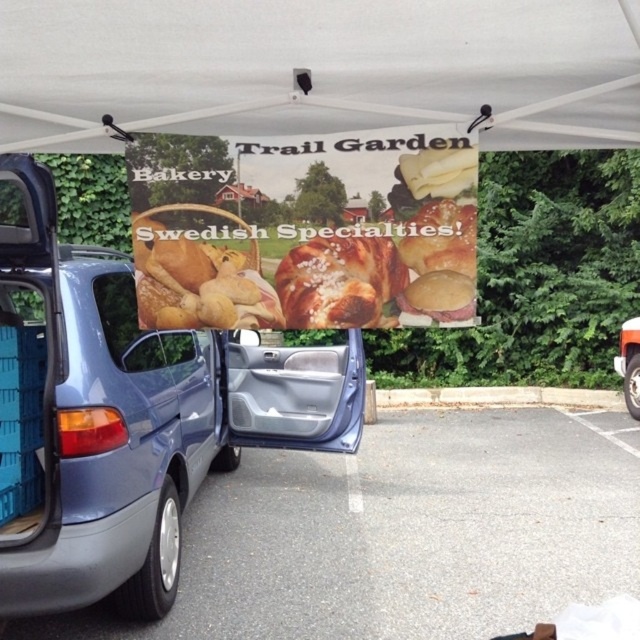
Question: Does gray asphalt parking lot at lower left come behind breadcrustyatcenter?

Choices:
 (A) yes
 (B) no

Answer: (A)

Question: Which of the following is the farthest from the observer?

Choices:
 (A) golden crusty bread at center
 (B) brown matte bun at center
 (C) breadcrustyatcenter

Answer: (B)

Question: Is breadcrustyatcenter wider than golden brown bread at center?

Choices:
 (A) no
 (B) yes

Answer: (B)

Question: Which of the following is the closest to the observer?

Choices:
 (A) yellow cheese at upper center
 (B) golden brown bread at center
 (C) brown matte bun at center
 (D) gray asphalt parking lot at lower left

Answer: (B)

Question: Considering the real-world distances, which object is closest to the yellow cheese at upper center?

Choices:
 (A) brown matte bun at center
 (B) golden crusty bread at center
 (C) gray asphalt parking lot at lower left
 (D) metallic blue minivan at center

Answer: (A)

Question: Is golden brown bread at center further to camera compared to yellow cheese at upper center?

Choices:
 (A) yes
 (B) no

Answer: (B)